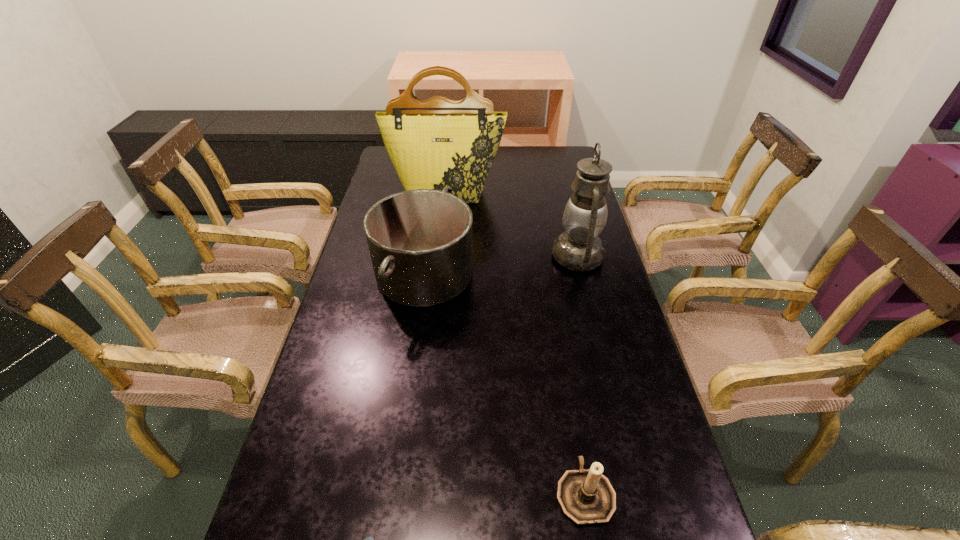
Identify the location of the tallest object. (439, 142).

This screenshot has height=540, width=960. Identify the location of tote bag. (439, 142).

Identify the location of oil lamp. The width and height of the screenshot is (960, 540). (579, 248).

This screenshot has width=960, height=540. What are the coordinates of `pan` in the screenshot? It's located at (420, 241).

Find the location of `the second shortest object`. the second shortest object is located at coordinates tap(586, 496).

Image resolution: width=960 pixels, height=540 pixels. I want to click on candle holder, so click(x=586, y=496).

Identify the location of free space located on the front-facing side of the tallest object. The height and width of the screenshot is (540, 960). (440, 254).

In order to click on free space located on the left of the oil lamp in this screenshot , I will do `click(512, 256)`.

Where is `blank space located 0.230m on the back of the third shortest object`? blank space located 0.230m on the back of the third shortest object is located at coordinates (435, 197).

Identify the location of free space located on the left of the fourth farthest object. (481, 492).